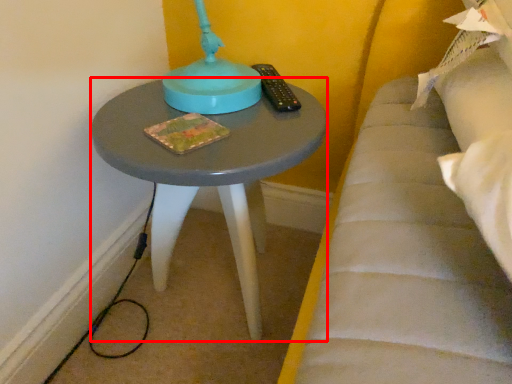
Question: From the image, what is the correct spatial relationship of table (annotated by the red box) in relation to remote?

Choices:
 (A) right
 (B) left

Answer: (B)